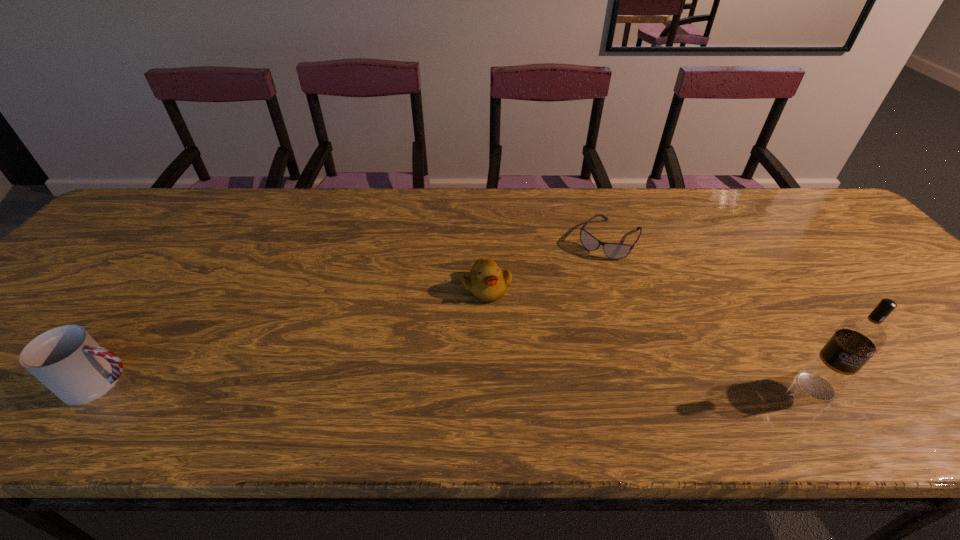
The image size is (960, 540). I want to click on vacant space on the desktop that is between the third shortest object and the tallest object and is positioned on the front-facing side of the duckling, so click(544, 385).

What are the coordinates of `free space on the desktop that is between the third shortest object and the vodka and is positioned on the lenses of the farthest object` in the screenshot? It's located at [x=509, y=385].